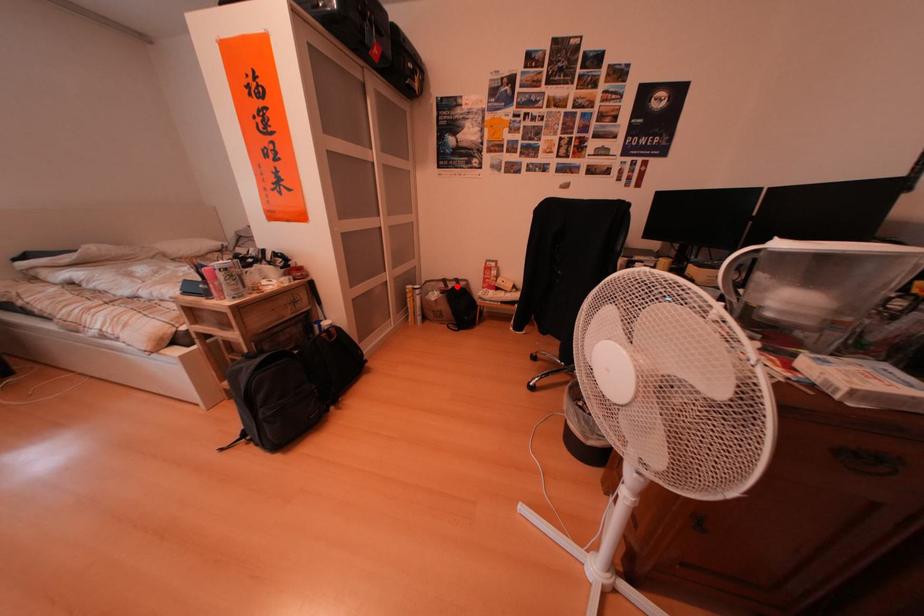
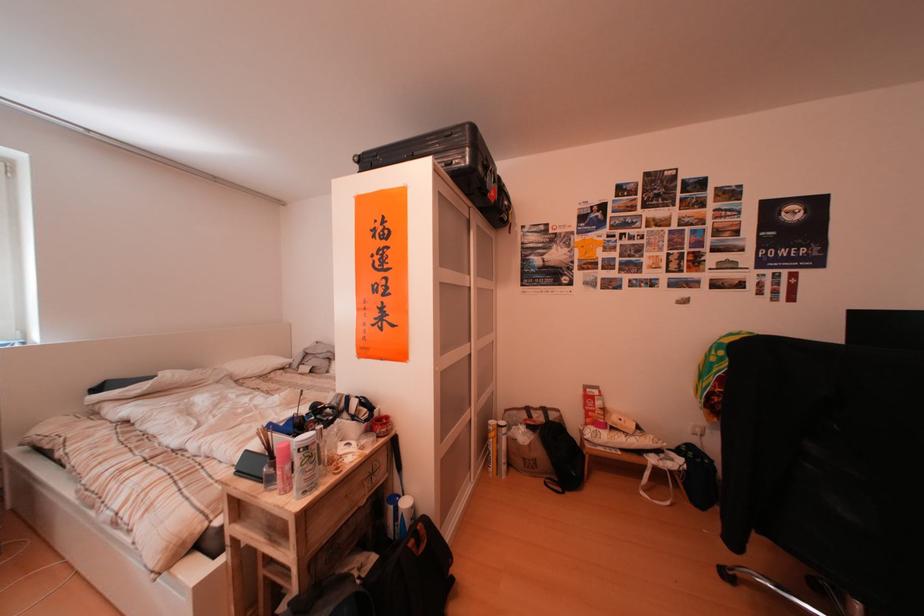
Where in the second image is the point corresponding to the highlighted location from the first image?

(541, 415)